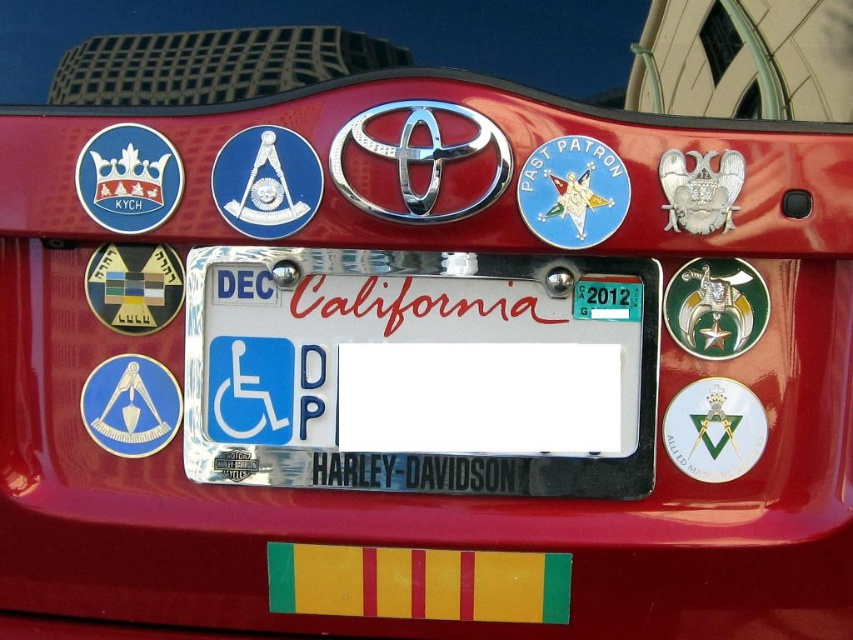
Describe the element at coordinates (415, 372) in the screenshot. The image size is (853, 640). I see `white plastic license plate at center` at that location.

Is the position of white plastic license plate at center more distant than that of white glossy emblem at center?

No, white plastic license plate at center is in front of white glossy emblem at center.

In the scene shown: Who is more distant from viewer, (596, 483) or (730, 464)?

The point (730, 464) is behind.

I want to click on white plastic license plate at center, so [415, 372].

Is blue glossy masonic symbol at lower left shorter than green plastic sticker at center?

In fact, blue glossy masonic symbol at lower left may be taller than green plastic sticker at center.

Does blue glossy masonic symbol at lower left have a smaller size compared to green plastic sticker at center?

Incorrect, blue glossy masonic symbol at lower left is not smaller in size than green plastic sticker at center.

You are a GUI agent. You are given a task and a screenshot of the screen. Output one action in this format:
    pyautogui.click(x=<x>, y=<y>)
    Task: Click on the blue glossy masonic symbol at lower left
    
    Given the screenshot: What is the action you would take?
    pyautogui.click(x=131, y=404)

Is white plastic license plate at center bigger than green plastic sticker at center?

Correct, white plastic license plate at center is larger in size than green plastic sticker at center.

Does white plastic license plate at center have a lesser width compared to green plastic sticker at center?

No.

Where is `white plastic license plate at center`? The height and width of the screenshot is (640, 853). white plastic license plate at center is located at coordinates (415, 372).

I want to click on white plastic license plate at center, so click(x=415, y=372).